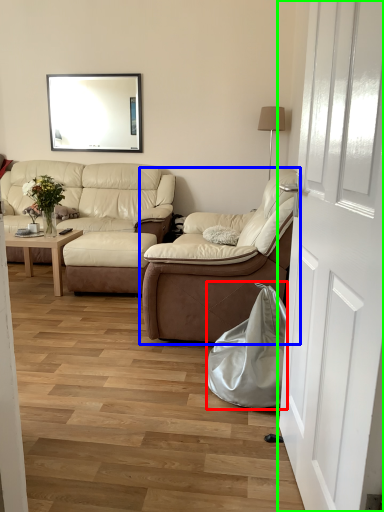
Question: Which object is positioned closest to material (highlighted by a red box)? Select from studio couch (highlighted by a blue box) and door (highlighted by a green box).

Choices:
 (A) studio couch
 (B) door

Answer: (A)